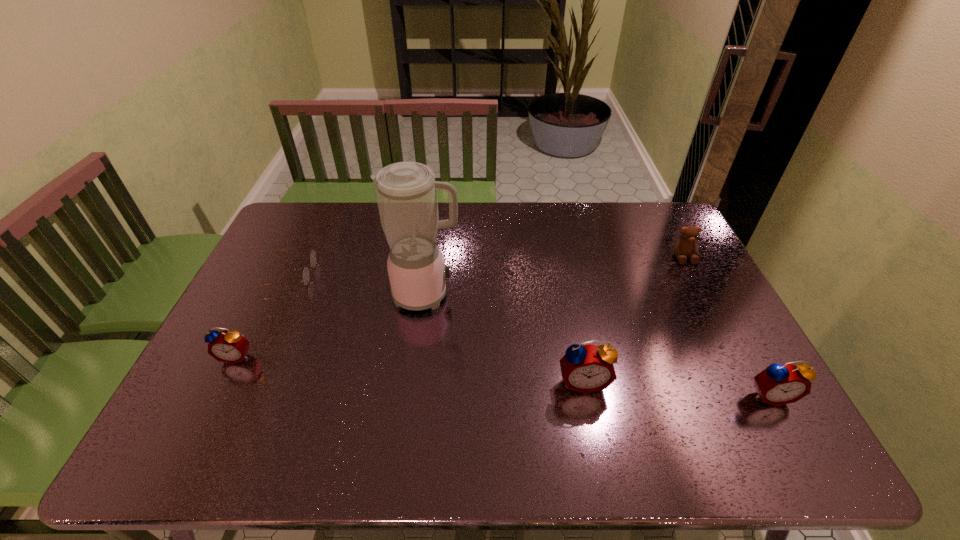
Please point a space for a new alarm_clock to maintain equal intervals. Please provide its 2D coordinates. Your answer should be formatted as a tuple, i.e. [(x, y)], where the tuple contains the x and y coordinates of a point satisfying the conditions above.

[(405, 368)]